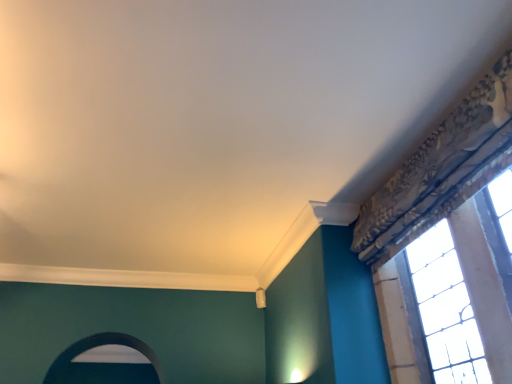
Question: Is smooth white archway at lower left wider than stained glass window at upper right?

Choices:
 (A) no
 (B) yes

Answer: (B)

Question: Considering the relative sizes of smooth white archway at lower left and stained glass window at upper right in the image provided, is smooth white archway at lower left taller than stained glass window at upper right?

Choices:
 (A) yes
 (B) no

Answer: (B)

Question: Can you confirm if smooth white archway at lower left is thinner than stained glass window at upper right?

Choices:
 (A) yes
 (B) no

Answer: (B)

Question: Does smooth white archway at lower left have a larger size compared to stained glass window at upper right?

Choices:
 (A) yes
 (B) no

Answer: (B)

Question: From the image's perspective, is smooth white archway at lower left beneath stained glass window at upper right?

Choices:
 (A) no
 (B) yes

Answer: (B)

Question: Can you confirm if smooth white archway at lower left is positioned to the right of stained glass window at upper right?

Choices:
 (A) yes
 (B) no

Answer: (B)

Question: Could you tell me if stained glass window at upper right is facing smooth white archway at lower left?

Choices:
 (A) yes
 (B) no

Answer: (B)

Question: Is smooth white archway at lower left inside stained glass window at upper right?

Choices:
 (A) yes
 (B) no

Answer: (B)

Question: Considering the relative positions of stained glass window at upper right and smooth white archway at lower left in the image provided, is stained glass window at upper right to the right of smooth white archway at lower left from the viewer's perspective?

Choices:
 (A) yes
 (B) no

Answer: (A)

Question: Does stained glass window at upper right appear on the left side of smooth white archway at lower left?

Choices:
 (A) yes
 (B) no

Answer: (B)

Question: Can you confirm if stained glass window at upper right is smaller than smooth white archway at lower left?

Choices:
 (A) yes
 (B) no

Answer: (B)

Question: From the image's perspective, is stained glass window at upper right above smooth white archway at lower left?

Choices:
 (A) yes
 (B) no

Answer: (A)

Question: Is stained glass window at upper right wider or thinner than smooth white archway at lower left?

Choices:
 (A) thin
 (B) wide

Answer: (A)